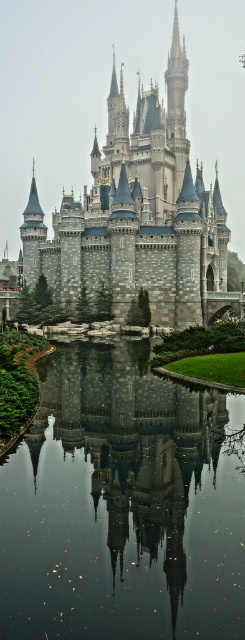
Question: Is transparent glass lake at center closer to camera compared to stone castle at center?

Choices:
 (A) no
 (B) yes

Answer: (B)

Question: Can you confirm if transparent glass lake at center is positioned to the right of stone castle at center?

Choices:
 (A) no
 (B) yes

Answer: (A)

Question: Does transparent glass lake at center have a greater width compared to stone castle at center?

Choices:
 (A) no
 (B) yes

Answer: (A)

Question: Which point appears closest to the camera in this image?

Choices:
 (A) (171, 413)
 (B) (58, 216)

Answer: (A)

Question: Which of the following is the farthest from the observer?

Choices:
 (A) (57, 256)
 (B) (103, 556)

Answer: (A)